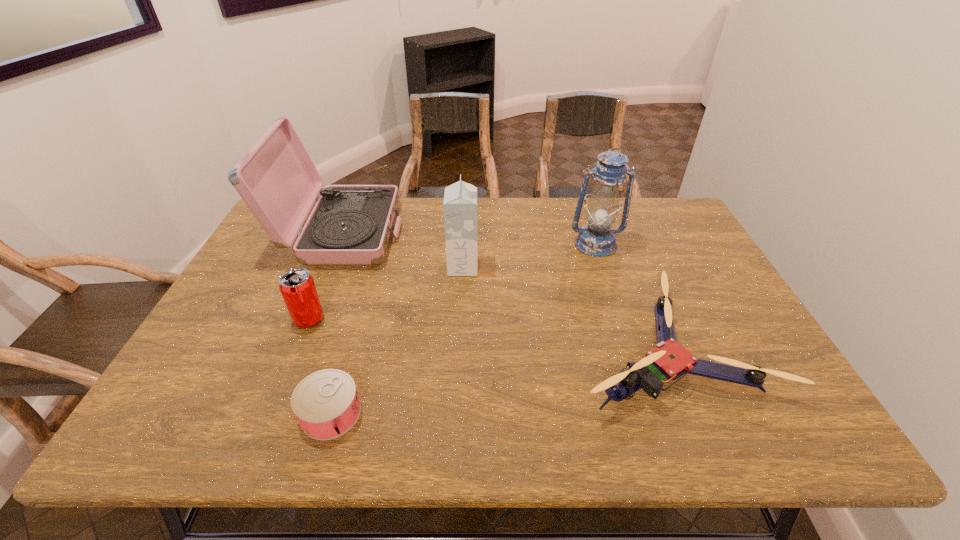
You are a GUI agent. You are given a task and a screenshot of the screen. Output one action in this format:
    pyautogui.click(x=<x>, y=<y>)
    Task: Click on the vacant space that is in between the shortest object and the fourth tallest object
    
    Given the screenshot: What is the action you would take?
    [320, 367]

Where is `free area in between the shortest object and the lantern`? free area in between the shortest object and the lantern is located at coordinates (463, 329).

The height and width of the screenshot is (540, 960). I want to click on vacant space that is in between the fourth tallest object and the record player, so click(325, 276).

Locate an element on the screen. Image resolution: width=960 pixels, height=540 pixels. vacant space that's between the third shortest object and the shortest object is located at coordinates (320, 367).

Find the location of `object that ranks as the fifth closest to the fourth object from left to right`. object that ranks as the fifth closest to the fourth object from left to right is located at coordinates (326, 404).

Identify which object is located as the third nearest to the carton. Please provide its 2D coordinates. Your answer should be formatted as a tuple, i.e. [(x, y)], where the tuple contains the x and y coordinates of a point satisfying the conditions above.

[(597, 239)]

I want to click on free space that satisfies the following two spatial constraints: 1. on the front-facing side of the lantern; 2. on the front label of the carton, so click(603, 267).

Identify the location of blank space that satisfies the following two spatial constraints: 1. with the lid open on the record player; 2. on the right side of the second shortest object. 296,347.

Identify the location of vacant position in the image that satisfies the following two spatial constraints: 1. on the back side of the soda can; 2. with the lid open on the record player. (344, 233).

Find the location of a particular element. The width and height of the screenshot is (960, 540). free space that satisfies the following two spatial constraints: 1. on the front label of the fourth object from left to right; 2. on the back side of the drone is located at coordinates (459, 347).